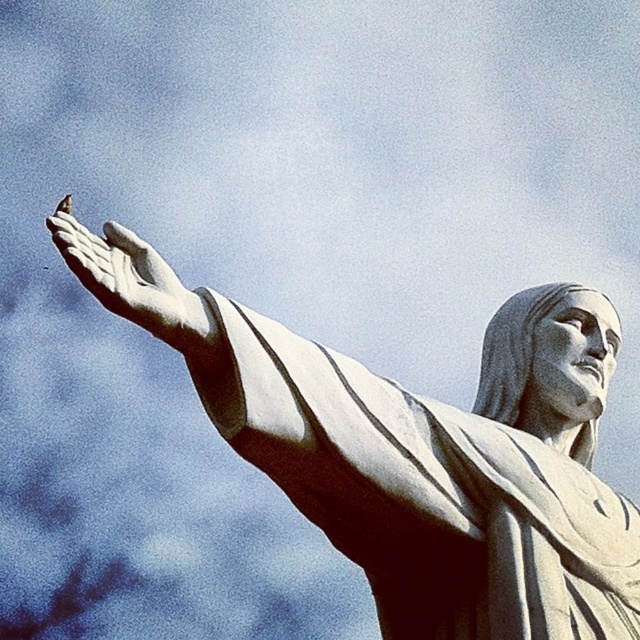
Who is taller, white marble statue at center or white marble hand at center?

white marble statue at center

In the scene shown: Does white marble statue at center have a larger size compared to white marble hand at center?

Indeed, white marble statue at center has a larger size compared to white marble hand at center.

Between point (518, 390) and point (129, 308), which one is positioned in front?

Point (129, 308)

In order to click on white marble statue at center in this screenshot , I will do `click(417, 451)`.